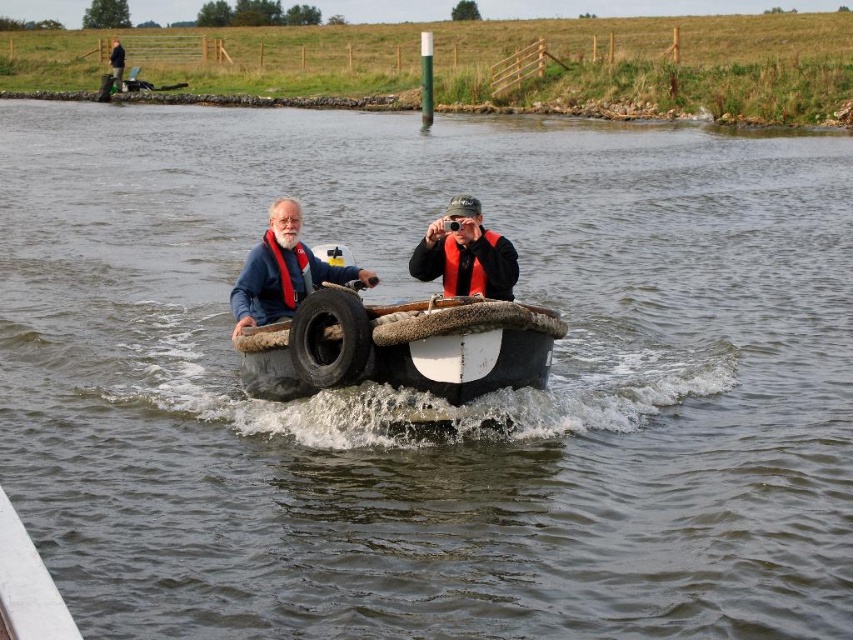
You are a photographer trying to capture the scene of the white rubber boat at center and the dark green jacket at upper left. Which object would appear taller in your photo?

The dark green jacket at upper left appears taller than the white rubber boat at center in the photo because the white rubber boat at center is not as tall as the dark green jacket at upper left.

You are a passenger in the boat and need to reach an item located near the black rubber tire at center. Which direction should you move relative to the dark green jacket at upper left?

You should move downward relative to the dark green jacket at upper left to reach the black rubber tire at center because the black rubber tire at center is located below the dark green jacket at upper left.

You are a photographer trying to capture the boat and the jacket in the scene. Since you want both the white rubber boat at center and the dark green jacket at upper left to be in focus, which object should you adjust your camera focus on first?

You should focus on the white rubber boat at center first because it is closer to the viewer than the dark green jacket at upper left, so adjusting focus starting from the closer object ensures both can be in focus.